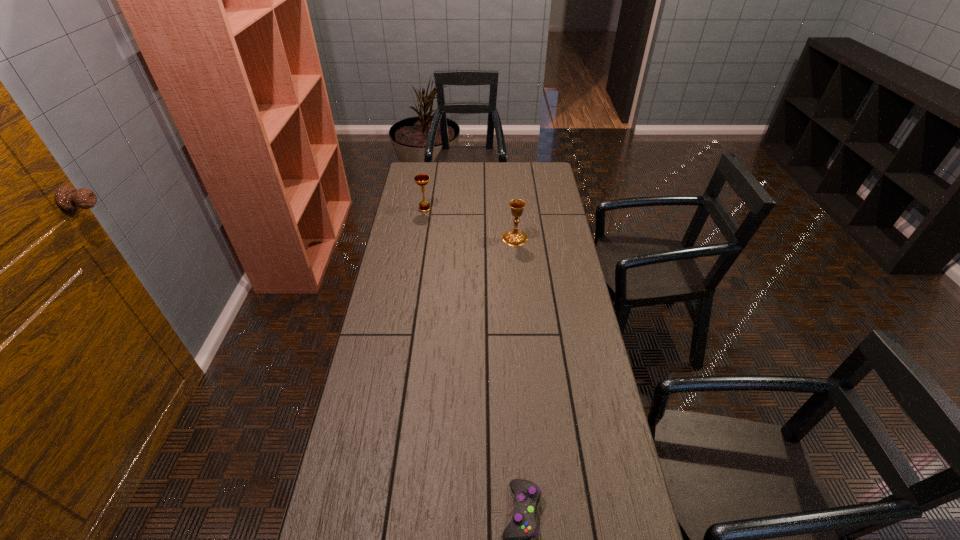
Identify the location of free space at the far left corner. Image resolution: width=960 pixels, height=540 pixels. (420, 168).

The image size is (960, 540). I want to click on free point at the far right corner, so click(529, 180).

Where is `vacant area that lies between the left chalice and the right chalice`? vacant area that lies between the left chalice and the right chalice is located at coordinates (469, 224).

The width and height of the screenshot is (960, 540). I want to click on the second closest object relative to the farther chalice, so click(516, 537).

The height and width of the screenshot is (540, 960). Identify the location of object that is the second closest to the control. (421, 179).